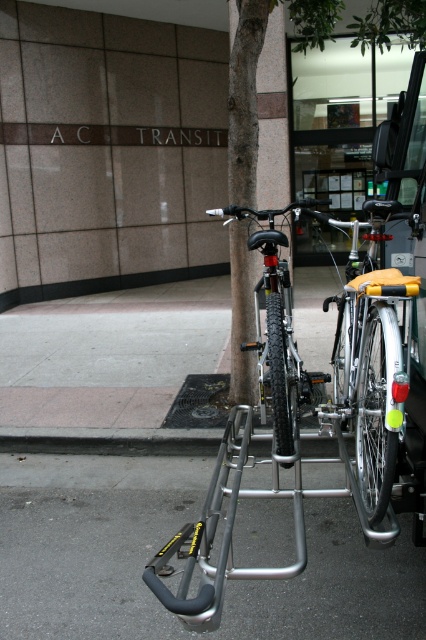
You are standing on the sidewalk looking at the bike rack attached to the bus. There is a metallic gray pavement at lower center. Can you tell me what is located at the point with coordinates (226, 588)?

The point at coordinates (226, 588) corresponds to the metallic gray pavement at lower center.

Consider the image. You are standing on the sidewalk looking at the bike rack attached to the A.C. TRANSIT bus. There is a point marked at coordinates (370,365). Which bicycle at the bike rack does this point correspond to?

The point at coordinates (370,365) corresponds to the matte black bicycle at center.